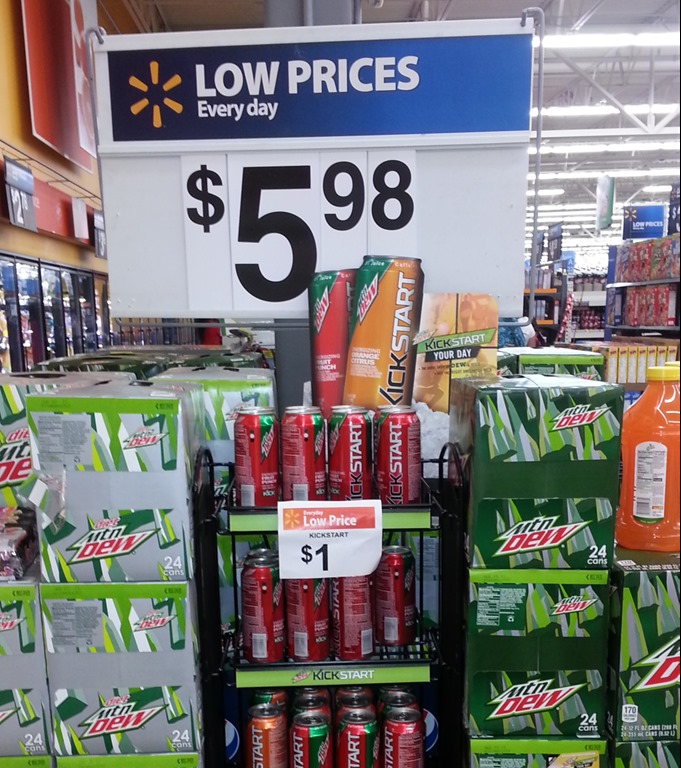
The image size is (681, 768). Identify the location of cooler glass doors upper left. (47, 319).